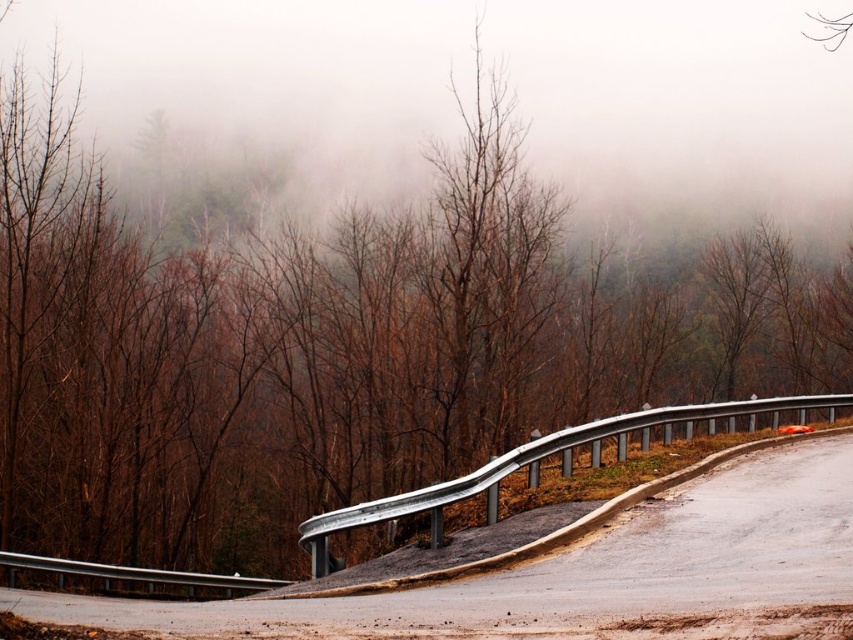
Is silver metallic guardrail at center bigger than silver metallic guardrail at lower left?

Yes.

Which is in front, point (323, 564) or point (195, 579)?

Point (323, 564) is in front.

Find the location of a particular element. The image size is (853, 640). silver metallic guardrail at center is located at coordinates (531, 461).